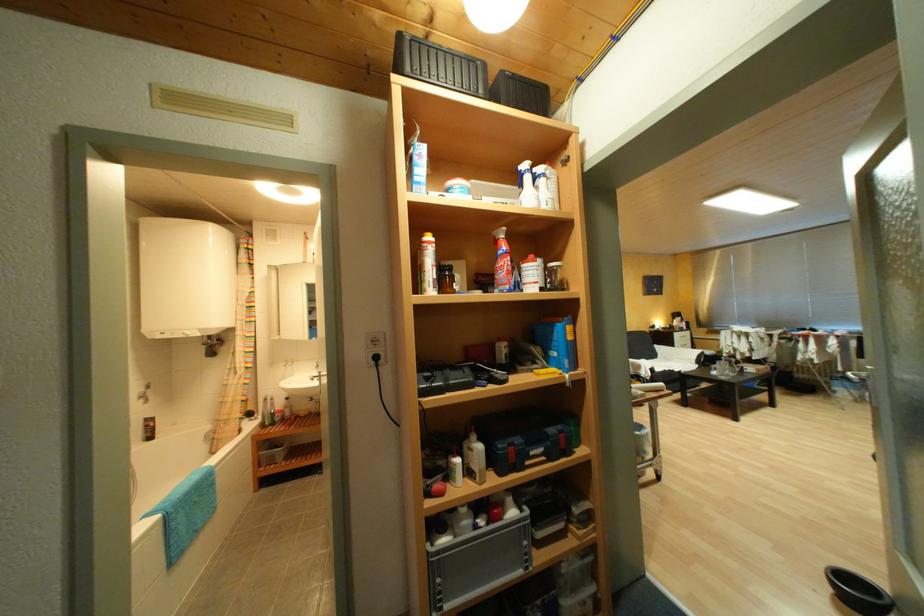
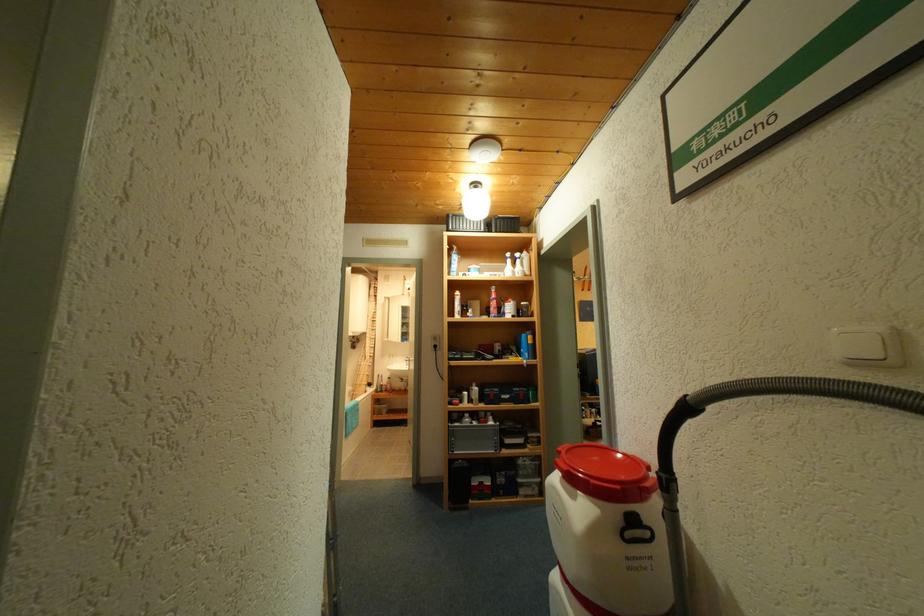
Locate, in the second image, the point that corresponds to (x=541, y=274) in the first image.

(518, 309)